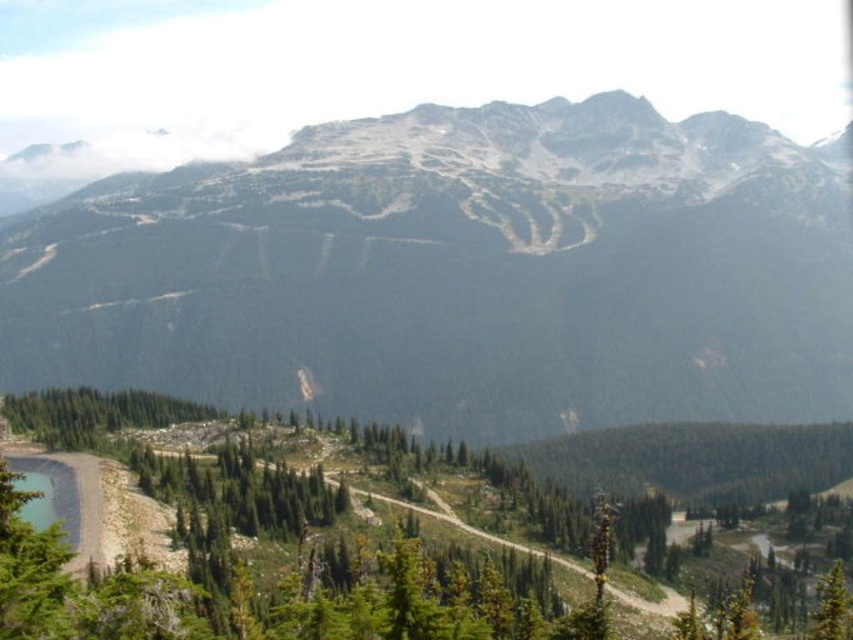
Is green textured tree at center smaller than green matte tree at lower right?

No, green textured tree at center is not smaller than green matte tree at lower right.

Who is more distant from viewer, [297,477] or [848,624]?

The point [297,477] is more distant.

Does point (129, 612) come farther from viewer compared to point (819, 608)?

No, (129, 612) is in front of (819, 608).

Locate an element on the screen. Image resolution: width=853 pixels, height=640 pixels. green textured tree at center is located at coordinates (286, 572).

Does rocky mountain at center have a lesser width compared to green matte tree at lower right?

Incorrect, rocky mountain at center's width is not less than green matte tree at lower right's.

Describe the element at coordinates (457, 273) in the screenshot. Image resolution: width=853 pixels, height=640 pixels. I see `rocky mountain at center` at that location.

Who is more distant from viewer, (604, 300) or (815, 632)?

Positioned behind is point (604, 300).

Image resolution: width=853 pixels, height=640 pixels. Find the location of `rocky mountain at center`. rocky mountain at center is located at coordinates (457, 273).

Is rocky mountain at center further to camera compared to green textured tree at center?

Yes, rocky mountain at center is further from the viewer.

Does point (173, 284) come farther from viewer compared to point (93, 595)?

Yes.

Locate an element on the screen. rocky mountain at center is located at coordinates (x=457, y=273).